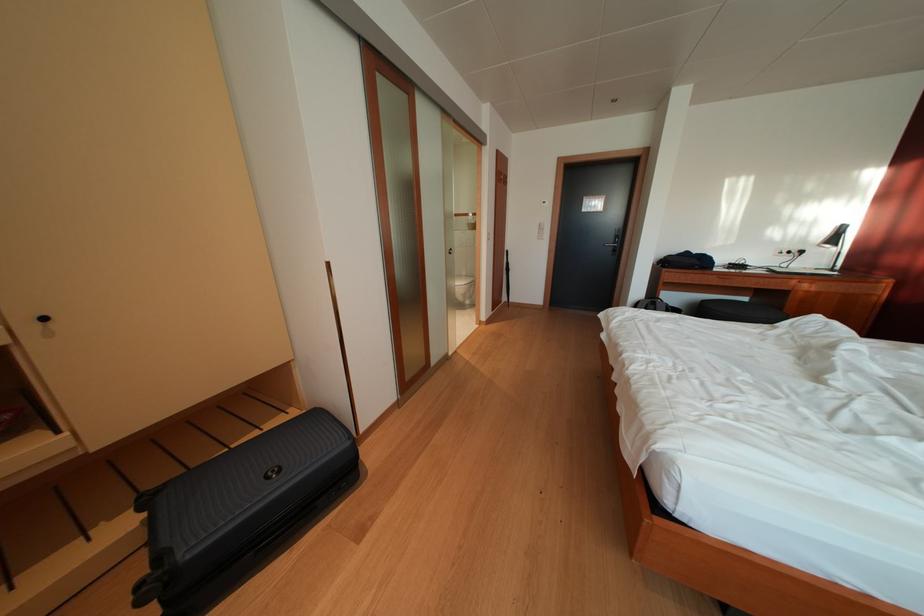
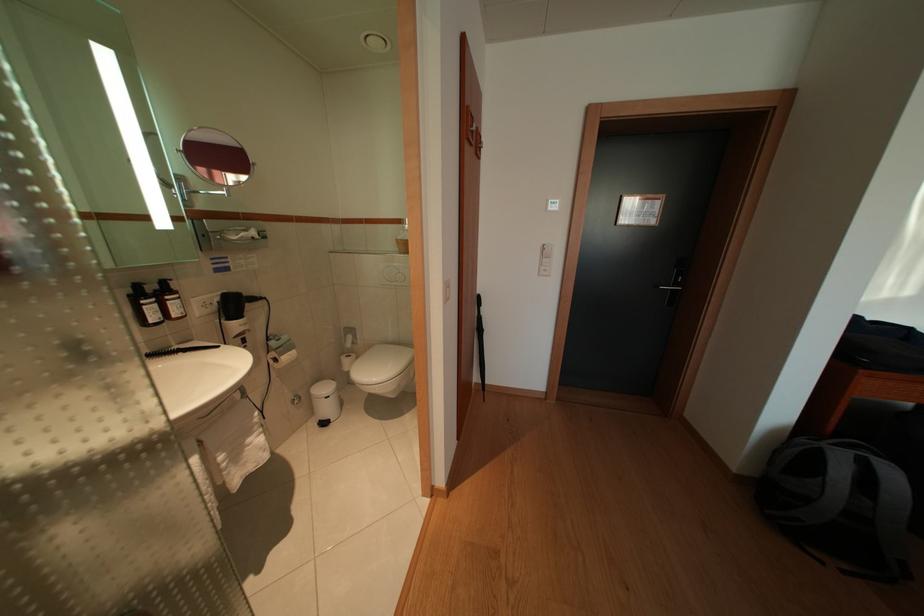
Question: In a continuous first-person perspective shot, in which direction is the camera moving?

Choices:
 (A) Left
 (B) Right
 (C) Forward
 (D) Backward

Answer: (C)